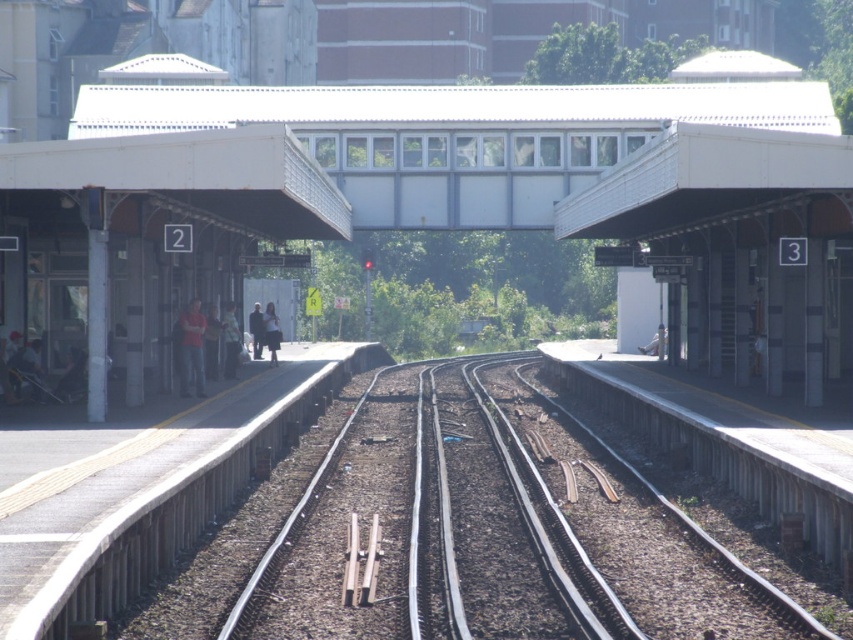
Locate an element on the screen. The image size is (853, 640). concrete platform at left is located at coordinates 171,499.

Find the location of a particular element. Image resolution: width=853 pixels, height=640 pixels. concrete platform at left is located at coordinates (171, 499).

Which of these two, concrete platform at left or red fabric jacket at left, stands shorter?

Standing shorter between the two is concrete platform at left.

Who is higher up, concrete platform at left or red fabric jacket at left?

red fabric jacket at left

Who is more forward, (x=178, y=545) or (x=213, y=332)?

Point (x=178, y=545) is more forward.

This screenshot has height=640, width=853. In order to click on concrete platform at left in this screenshot , I will do `click(171, 499)`.

Based on the photo, does matte red shirt at left appear under light blue denim jacket at left?

Yes, matte red shirt at left is below light blue denim jacket at left.

Is point (180, 337) in front of point (224, 340)?

Yes, it is in front of point (224, 340).

Who is more forward, (x=196, y=380) or (x=238, y=332)?

Point (x=196, y=380) is more forward.

Where is `matte red shirt at left`? The height and width of the screenshot is (640, 853). matte red shirt at left is located at coordinates (190, 348).